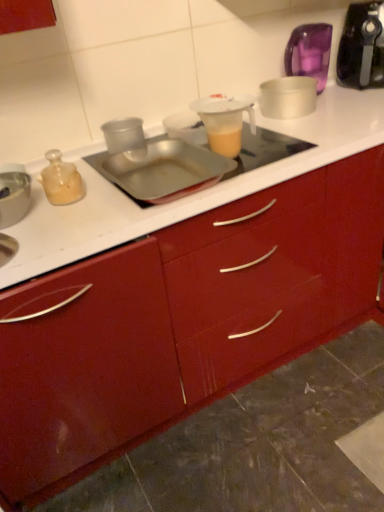
Question: From the image's perspective, does black plastic blender at upper right appear lower than translucent purple container at upper right, the 1th appliance positioned from the back?

Choices:
 (A) yes
 (B) no

Answer: (B)

Question: Is the depth of black plastic blender at upper right less than that of translucent purple container at upper right, positioned as the first appliance in right-to-left order?

Choices:
 (A) no
 (B) yes

Answer: (B)

Question: Considering the relative sizes of black plastic blender at upper right and translucent purple container at upper right, which is counted as the fourth appliance, starting from the front, in the image provided, is black plastic blender at upper right shorter than translucent purple container at upper right, which is counted as the fourth appliance, starting from the front,?

Choices:
 (A) yes
 (B) no

Answer: (B)

Question: Considering the relative positions of black plastic blender at upper right and translucent purple container at upper right, placed as the 4th appliance when sorted from bottom to top, in the image provided, is black plastic blender at upper right to the right of translucent purple container at upper right, placed as the 4th appliance when sorted from bottom to top, from the viewer's perspective?

Choices:
 (A) yes
 (B) no

Answer: (A)

Question: Does black plastic blender at upper right lie behind translucent purple container at upper right, the 4th appliance from the left?

Choices:
 (A) no
 (B) yes

Answer: (A)

Question: Can you confirm if black plastic blender at upper right is taller than translucent purple container at upper right, placed as the 4th appliance when sorted from bottom to top?

Choices:
 (A) yes
 (B) no

Answer: (A)

Question: Can you confirm if transparent plastic cup at center, which is counted as the 2th appliance, starting from the front, is positioned to the right of translucent purple container at upper right, the 4th appliance from the left?

Choices:
 (A) yes
 (B) no

Answer: (B)

Question: From a real-world perspective, is transparent plastic cup at center, which is the third appliance in right-to-left order, physically below translucent purple container at upper right, the 1th appliance positioned from the back?

Choices:
 (A) no
 (B) yes

Answer: (B)

Question: From a real-world perspective, is transparent plastic cup at center, the second appliance when ordered from left to right, physically above translucent purple container at upper right, acting as the first appliance starting from the top?

Choices:
 (A) no
 (B) yes

Answer: (A)

Question: Does transparent plastic cup at center, acting as the second appliance starting from the bottom, have a lesser width compared to translucent purple container at upper right, positioned as the first appliance in right-to-left order?

Choices:
 (A) no
 (B) yes

Answer: (B)

Question: Is transparent plastic cup at center, placed as the third appliance when sorted from top to bottom, in front of translucent purple container at upper right, positioned as the first appliance in right-to-left order?

Choices:
 (A) no
 (B) yes

Answer: (B)

Question: Is transparent plastic cup at center, acting as the third appliance starting from the back, looking in the opposite direction of translucent purple container at upper right, the 1th appliance positioned from the back?

Choices:
 (A) no
 (B) yes

Answer: (A)

Question: Is there a large distance between glossy red cabinet at center and transparent plastic cup at center, placed as the third appliance when sorted from top to bottom?

Choices:
 (A) no
 (B) yes

Answer: (A)